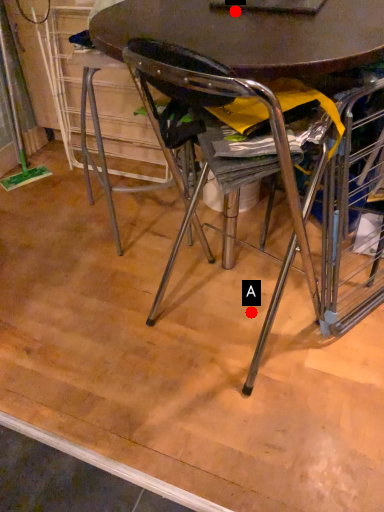
Question: Two points are circled on the image, labeled by A and B beside each circle. Which point is closer to the camera?

Choices:
 (A) A is closer
 (B) B is closer

Answer: (B)